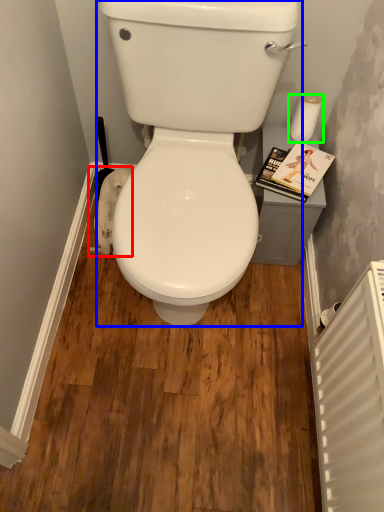
Question: Estimate the real-world distances between objects in this image. Which object is farther from toilet paper (highlighted by a red box), porcelain (highlighted by a blue box) or toilet paper (highlighted by a green box)?

Choices:
 (A) porcelain
 (B) toilet paper

Answer: (B)